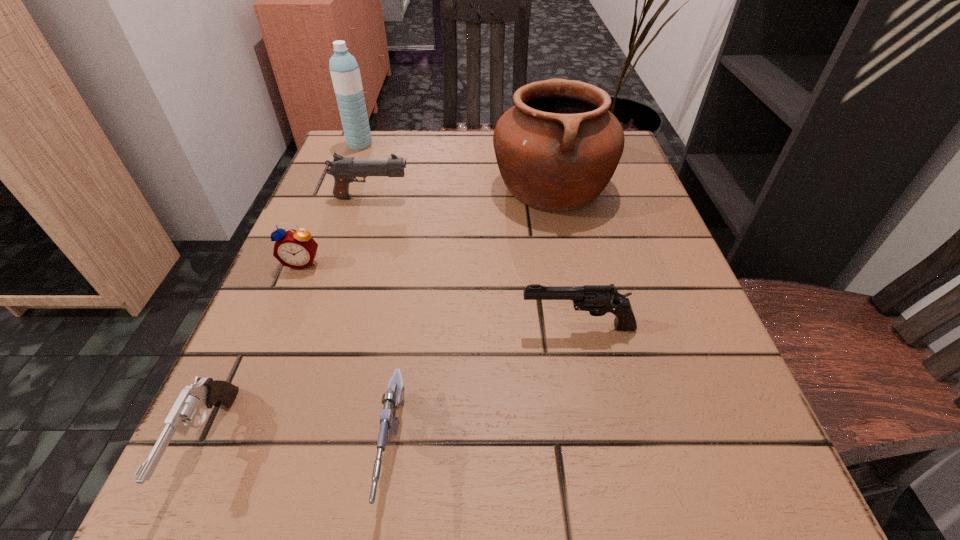
Locate an element on the screen. The image size is (960, 540). free space at the far right corner of the desktop is located at coordinates (634, 173).

Find the location of a particular element. The height and width of the screenshot is (540, 960). free space between the second tallest object and the leftmost gun is located at coordinates (380, 315).

Locate an element on the screen. The height and width of the screenshot is (540, 960). vacant point located between the third gun from left to right and the farthest gun is located at coordinates (383, 325).

You are a GUI agent. You are given a task and a screenshot of the screen. Output one action in this format:
    pyautogui.click(x=<x>, y=<y>)
    Task: Click on the free spot between the farthest gun and the fourth nearest object
    
    Given the screenshot: What is the action you would take?
    pyautogui.click(x=337, y=230)

Identify the location of vacant space that is in between the second tallest object and the second gun from left to right. coord(462,192).

I want to click on free space between the third nearest object and the farthest object, so click(x=468, y=236).

Where is `free spot between the farthest gun and the alarm clock`? free spot between the farthest gun and the alarm clock is located at coordinates (337, 230).

In order to click on free space between the second gun from right to left and the fourth farthest object in this screenshot , I will do `click(348, 358)`.

This screenshot has width=960, height=540. I want to click on free space between the alarm clock and the third object from right to left, so click(348, 358).

Where is `object that is the closest to the rightmost gun`? object that is the closest to the rightmost gun is located at coordinates (393, 399).